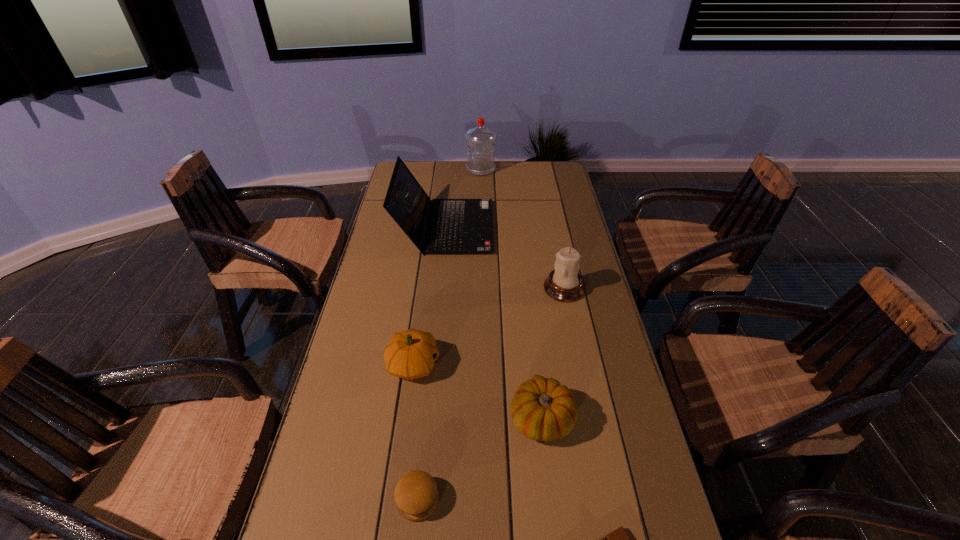
Locate an element on the screen. This screenshot has height=540, width=960. free space located 0.160m on the handle side of the farthest object is located at coordinates (430, 170).

You are a GUI agent. You are given a task and a screenshot of the screen. Output one action in this format:
    pyautogui.click(x=<x>, y=<y>)
    Task: Click on the free point located on the handle side of the farthest object
    This screenshot has width=960, height=540.
    Given the screenshot: What is the action you would take?
    pyautogui.click(x=405, y=170)

At what (x,y) coordinates should I click in order to perform the action: click on free point located 0.270m on the handle side of the farthest object. Please return your answer as a coordinate pair (x, y). Looking at the image, I should click on (405, 170).

The height and width of the screenshot is (540, 960). Find the location of `vacant area situated on the screen of the laptop computer`. vacant area situated on the screen of the laptop computer is located at coordinates (512, 227).

I want to click on vacant position located 0.160m on the left of the candle holder, so click(492, 288).

The image size is (960, 540). What are the coordinates of `free space located on the side of the taller gourd with the carved face` in the screenshot? It's located at (550, 364).

Identify the location of vacant region located 0.160m on the front of the shorter gourd. The image size is (960, 540). (554, 527).

At what (x,y) coordinates should I click in order to perform the action: click on free region located 0.400m on the back of the sixth tallest object. Please return your answer as a coordinate pair (x, y). This screenshot has height=540, width=960. Looking at the image, I should click on (434, 335).

At what (x,y) coordinates should I click in order to perform the action: click on object located at the far edge. Please return your answer as a coordinate pair (x, y). Looking at the image, I should click on (481, 161).

The width and height of the screenshot is (960, 540). Find the location of `laptop computer at the left edge`. laptop computer at the left edge is located at coordinates (460, 226).